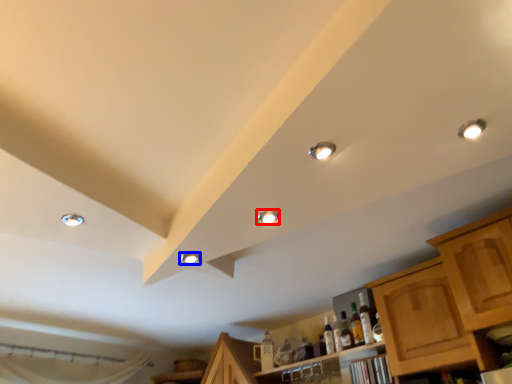
Question: Among these objects, which one is farthest to the camera, droplight (highlighted by a red box) or droplight (highlighted by a blue box)?

Choices:
 (A) droplight
 (B) droplight

Answer: (B)